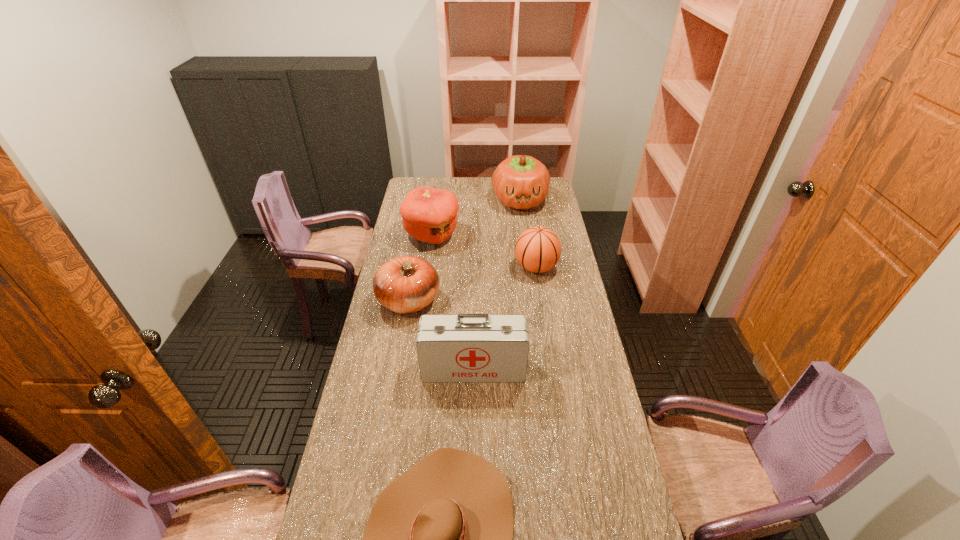
At what (x,y) coordinates should I click in order to perform the action: click on free space located 0.150m on the right of the shortest pumpkin. Please return your answer as a coordinate pair (x, y). Looking at the image, I should click on (479, 301).

Locate an element on the screen. This screenshot has height=540, width=960. object that is at the far edge is located at coordinates (521, 182).

Locate an element on the screen. This screenshot has height=540, width=960. pumpkin at the right edge is located at coordinates (521, 182).

Identify the location of basketball located in the right edge section of the desktop. (538, 249).

At what (x,y) coordinates should I click in order to perform the action: click on object that is positioned at the far right corner. Please return your answer as a coordinate pair (x, y). This screenshot has height=540, width=960. Looking at the image, I should click on (521, 182).

What are the coordinates of `vacant region at the far edge` in the screenshot? It's located at (482, 179).

The image size is (960, 540). Identify the location of vacant space at the left edge. click(398, 340).

In the image, there is a desktop. Where is `free space at the right edge`? The height and width of the screenshot is (540, 960). free space at the right edge is located at coordinates coord(567,455).

The width and height of the screenshot is (960, 540). Identify the location of vacant area between the fifth farthest object and the second farthest object. (453, 302).

The image size is (960, 540). Identify the location of free spot between the second farthest object and the rightmost pumpkin. (476, 218).